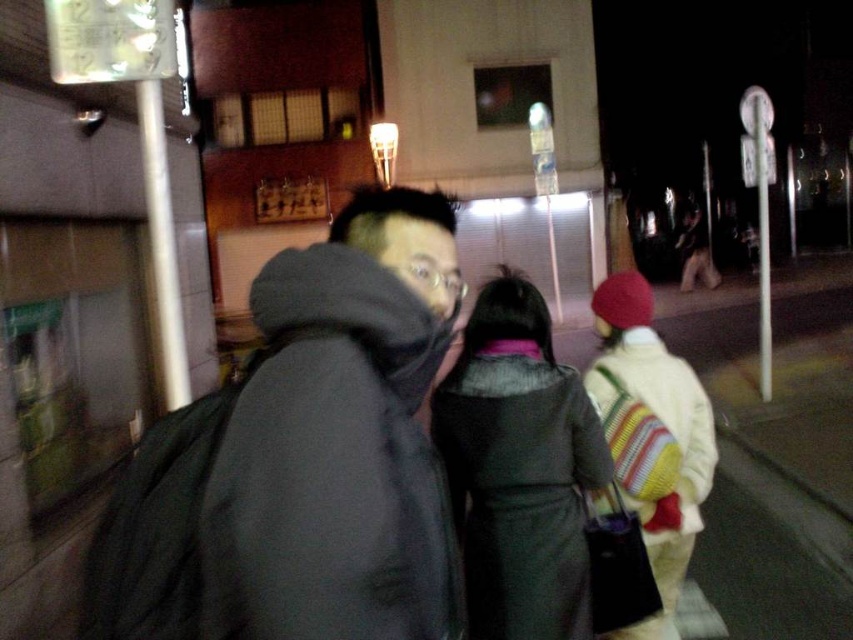
You are standing in the nighttime urban scene and want to reach the point at coordinates point (258,624). If your average walking pace is 3 feet per second, how many seconds will it take you to reach that point?

The distance between point (258,624) and the viewer is 34.86 inches. Converting inches to feet, 34.86 inches is approximately 2.905 feet. At a pace of 3 feet per second, it would take roughly 0.968 seconds to reach the point. Rounded to two decimal places, that is approximately 0.97 seconds.

Based on the scene description, which object is shorter between the dark gray hooded jacket at center and the dark gray wool coat at center?

The dark gray hooded jacket at center is shorter than the dark gray wool coat at center according to the description.

You are standing in the middle of the street in this nighttime scene. There are two points marked on the image. The first point is at coordinates point (282, 452) and the second point is at point (512, 547). Which of these two points is closer to you?

Point (282, 452) is closer to the viewer than point (512, 547).